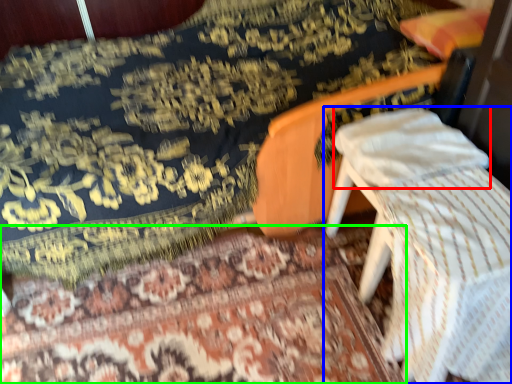
Question: Which object is positioned closest to pillow (highlighted by a red box)? Select from furniture (highlighted by a blue box) and mat (highlighted by a green box).

Choices:
 (A) furniture
 (B) mat

Answer: (A)